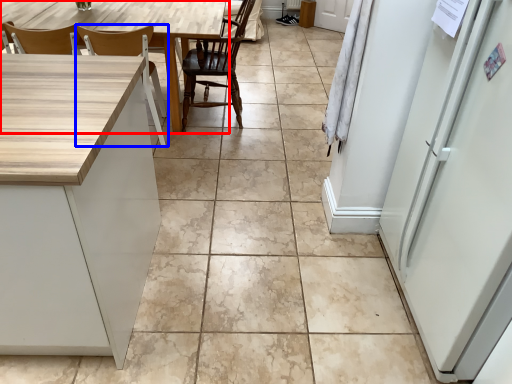
Question: Among these objects, which one is farthest to the camera, table (highlighted by a red box) or chair (highlighted by a blue box)?

Choices:
 (A) table
 (B) chair

Answer: (A)